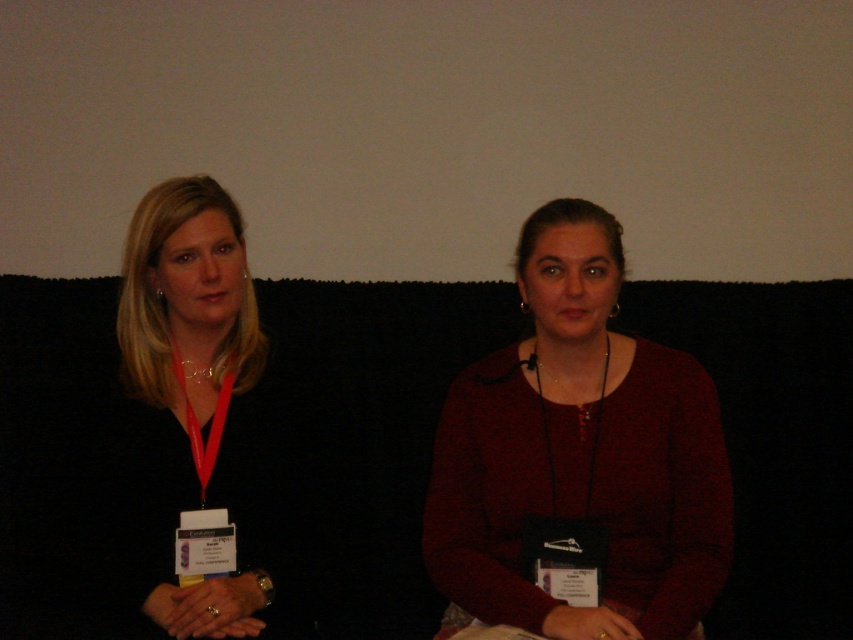
Does matte red sweater at center come in front of black matte lanyard at left?

Yes, matte red sweater at center is in front of black matte lanyard at left.

Where is `matte red sweater at center`? The image size is (853, 640). matte red sweater at center is located at coordinates (579, 458).

Find the location of a particular element. matte red sweater at center is located at coordinates (579, 458).

Which is behind, point (408, 552) or point (469, 593)?

The point (408, 552) is more distant.

Is black fabric couch at center above matte red sweater at center?

Incorrect, black fabric couch at center is not positioned above matte red sweater at center.

Does point (743, 307) lie in front of point (532, 250)?

No, it is behind (532, 250).

In order to click on black fabric couch at center in this screenshot , I will do `click(352, 442)`.

Between black fabric couch at center and black matte lanyard at left, which one appears on the left side from the viewer's perspective?

black matte lanyard at left

Measure the distance between black fabric couch at center and camera.

The distance of black fabric couch at center from camera is 4.79 feet.

Who is more forward, (175, 426) or (231, 582)?

Point (231, 582)

Where is `black fabric couch at center`? Image resolution: width=853 pixels, height=640 pixels. black fabric couch at center is located at coordinates (352, 442).